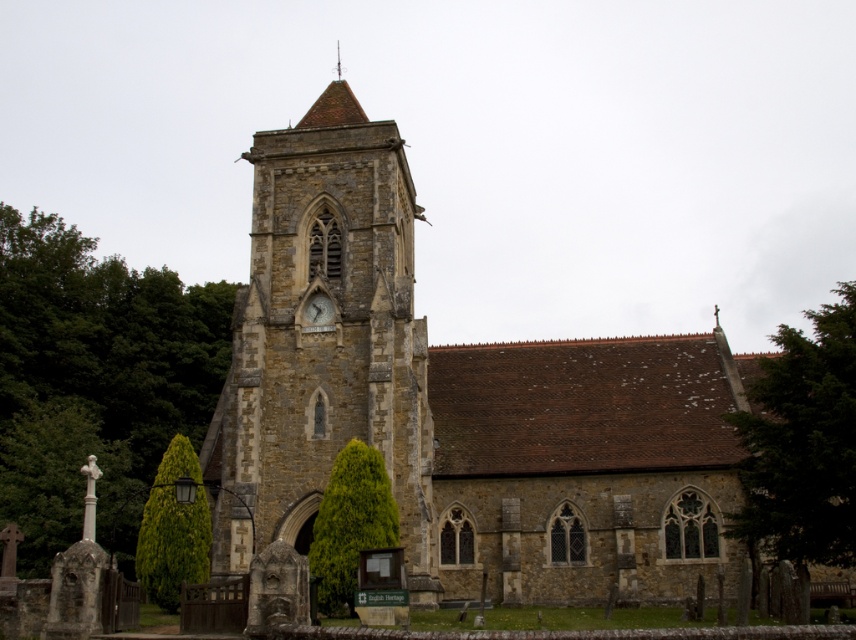
Based on the coordinates provided, where is the green leafy tree at left located in the image?

The green leafy tree at left is located at coordinates point (94, 380) in the image.

You are a tourist standing in front of the historic stone church. You notice a green leafy tree at left and a matte stone clock at center. Which object is bigger in size?

The green leafy tree at left is larger in size compared to the matte stone clock at center according to the description.

You are standing in front of the historic stone church and notice a green leafy tree at left and a matte stone clock at center. Which object is positioned to the left of the other?

The green leafy tree at left is positioned to the left of the matte stone clock at center.